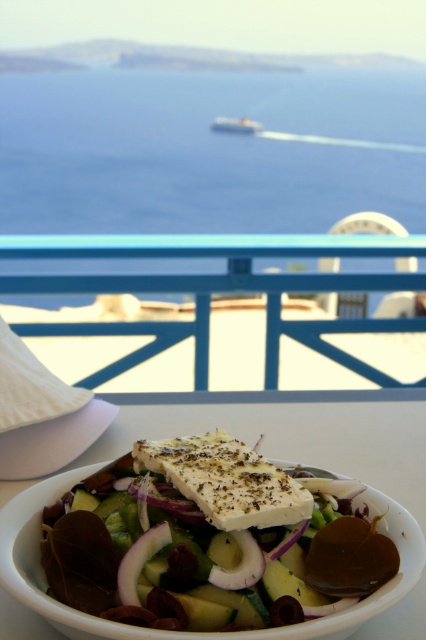
You are an observer sitting at the white table with the salad bowl. You notice the blue painted wood rail at upper center and the metallic silver boat at upper center in the distance. Which object appears larger in your view?

The blue painted wood rail at upper center appears larger than the metallic silver boat at upper center because it is closer to you.

You are planning to take a photo of the blue water at center and the metallic silver boat at upper center. Which object will occupy more space in your photo?

The blue water at center occupies more space in the photo because it is larger in size than the metallic silver boat at upper center.

You are standing at the edge of the white table where the salad bowl is placed. Looking towards the blue painted wood rail at upper center, can you determine its position relative to the center of the table?

The blue painted wood rail at upper center is located at point coordinates approximately 0.453 on the x axis and 0.509 on the y axis, which places it slightly to the right and above the center of the table.